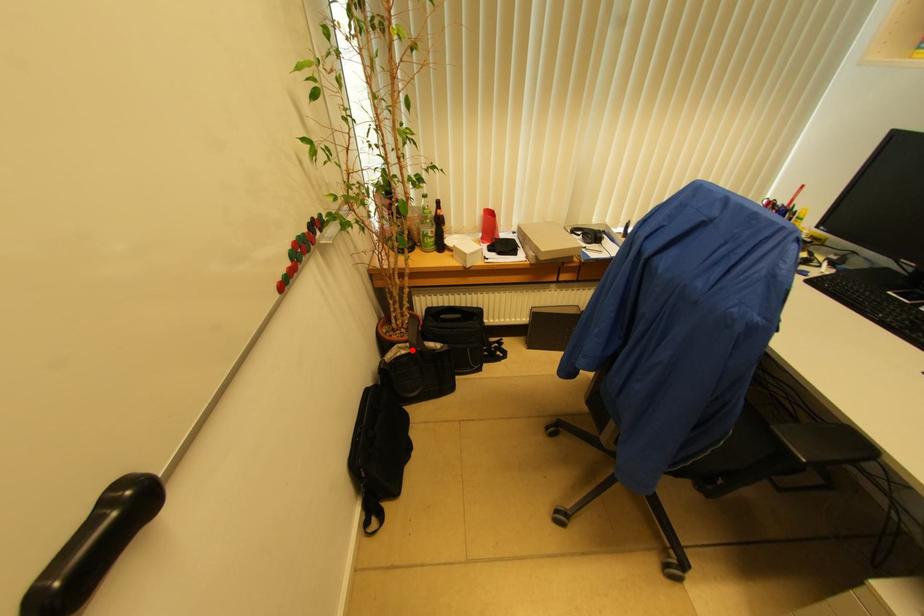
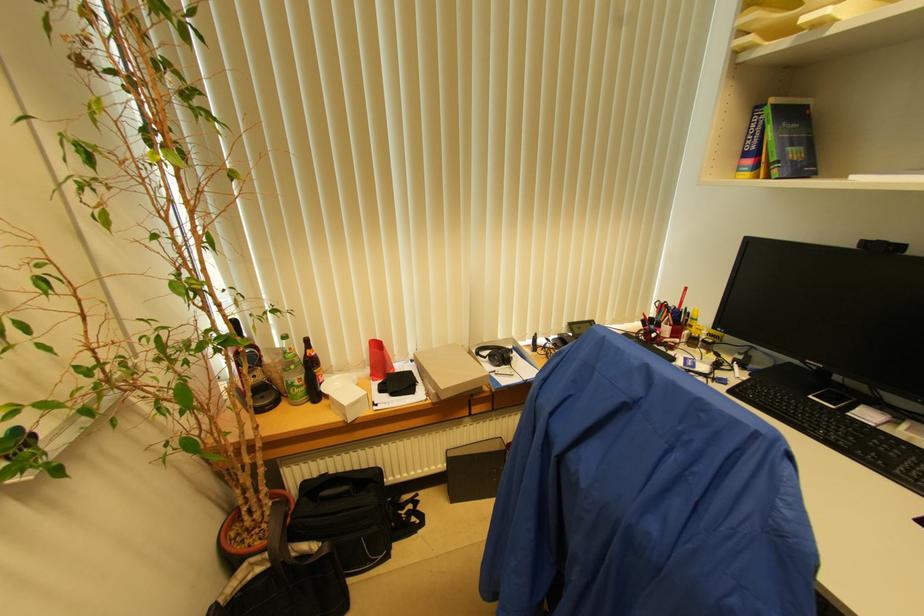
Question: I am providing you with two images of the same scene from different viewpoints. A red point is shown in image1. For the corresponding object point in image2, is it positioned nearer or farther from the camera?

Choices:
 (A) Nearer
 (B) Farther

Answer: (A)